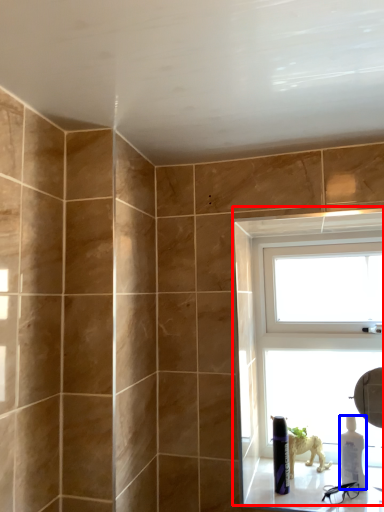
Question: Which of the following is the closest to the observer, window (highlighted by a red box) or bottle (highlighted by a blue box)?

Choices:
 (A) window
 (B) bottle

Answer: (B)